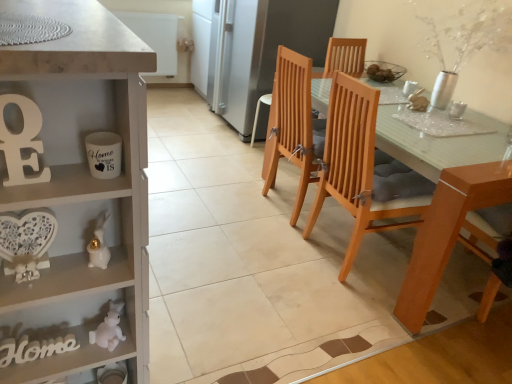
Question: From a real-world perspective, is white matte rabbit at lower left, marked as the 1th toy in a bottom-to-top arrangement, above or below satin silver refrigerator at center?

Choices:
 (A) below
 (B) above

Answer: (A)

Question: Is white matte rabbit at lower left, marked as the 1th toy in a bottom-to-top arrangement, in front of or behind satin silver refrigerator at center in the image?

Choices:
 (A) behind
 (B) front

Answer: (B)

Question: Which is nearer to the white glossy coffee cup at upper right, the 1th coffee cup viewed from the back?

Choices:
 (A) wooden chair with cushion at center, marked as the 2th chair in a right-to-left arrangement
 (B) white painted wood cabinet at left
 (C) white matte letter e at left
 (D) satin silver refrigerator at center
 (E) white matte rabbit at lower left, acting as the second toy starting from the front

Answer: (A)

Question: Based on their relative distances, which object is nearer to the clear glass cup at upper right, the second coffee cup in the back-to-front sequence?

Choices:
 (A) light brown wood chair at center, which appears as the first chair when viewed from the left
 (B) white glossy rabbit at lower left, the first toy viewed from the front
 (C) white matte rabbit at lower left, which is counted as the first toy, starting from the back
 (D) wooden chair with cushion at center, marked as the 2th chair in a right-to-left arrangement
 (E) white glossy mug at left, the 3th coffee cup positioned from the top

Answer: (D)